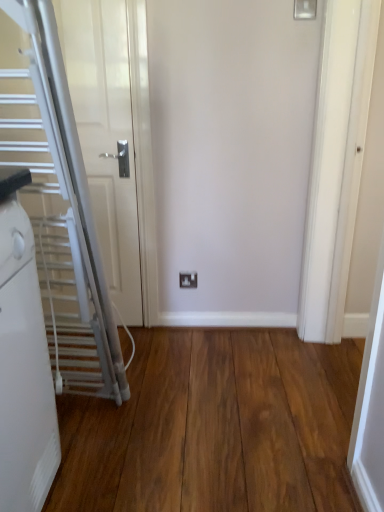
Find the location of a particular element. This screenshot has height=512, width=384. free spot above wooden floor at center (from a real-world perspective) is located at coordinates (184, 408).